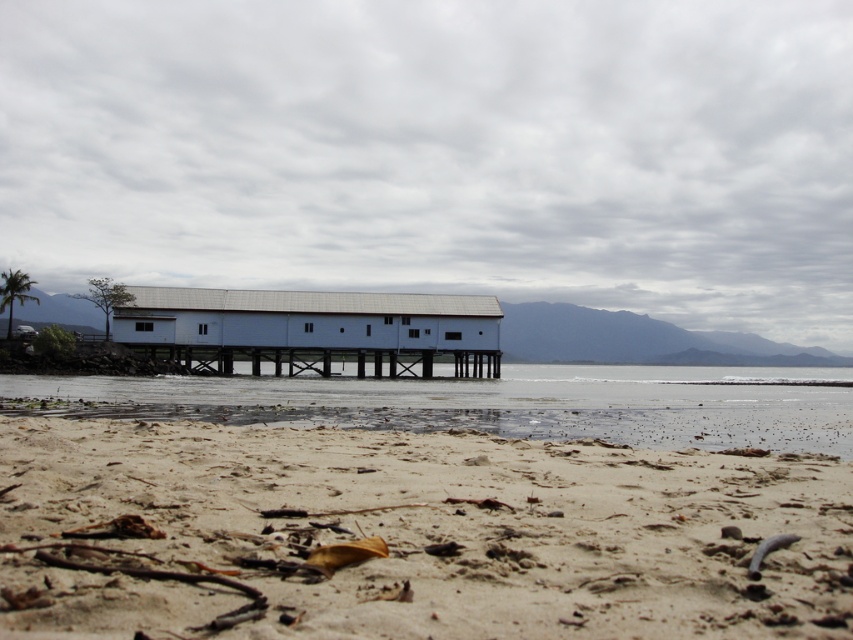
Between clear water at lower center and white painted wood dock at center, which one appears on the right side from the viewer's perspective?

Positioned to the right is clear water at lower center.

Which is in front, point (329, 413) or point (469, 371)?

Point (329, 413)

Find the location of a particular element. The height and width of the screenshot is (640, 853). clear water at lower center is located at coordinates (492, 403).

What do you see at coordinates (312, 330) in the screenshot? I see `white matte wooden hut at center` at bounding box center [312, 330].

Between point (463, 376) and point (321, 355), which one is positioned in front?

Point (321, 355)

The image size is (853, 640). Identify the location of white matte wooden hut at center. [312, 330].

Does light brown sandy beach at lower center have a lesser width compared to white painted wood dock at center?

Indeed, light brown sandy beach at lower center has a lesser width compared to white painted wood dock at center.

Is light brown sandy beach at lower center above white painted wood dock at center?

Yes, light brown sandy beach at lower center is above white painted wood dock at center.

Is point (409, 604) positioned before point (218, 355)?

Yes.

Where is `light brown sandy beach at lower center`? The width and height of the screenshot is (853, 640). light brown sandy beach at lower center is located at coordinates (410, 536).